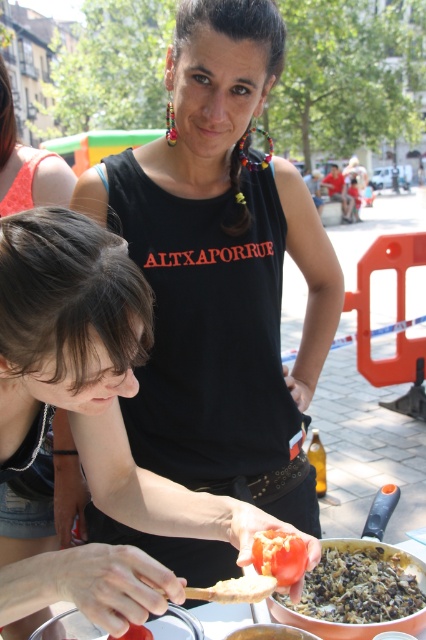
Question: Is dark brown textured rice at lower right bigger than red matte tomato at lower center?

Choices:
 (A) yes
 (B) no

Answer: (A)

Question: Is black matte tank top at center smaller than red matte tomato at lower center?

Choices:
 (A) yes
 (B) no

Answer: (B)

Question: Which of the following is the farthest from the observer?

Choices:
 (A) dark brown textured rice at lower right
 (B) red matte tomato at lower center
 (C) black matte tank top at center

Answer: (C)

Question: Which point is closer to the camera?

Choices:
 (A) pos(371,614)
 (B) pos(302,564)
 (C) pos(206,49)

Answer: (B)

Question: Is black matte tank top at center thinner than red matte tomato at lower center?

Choices:
 (A) no
 (B) yes

Answer: (A)

Question: Which point is farther to the camera?

Choices:
 (A) (287, 560)
 (B) (273, 344)

Answer: (B)